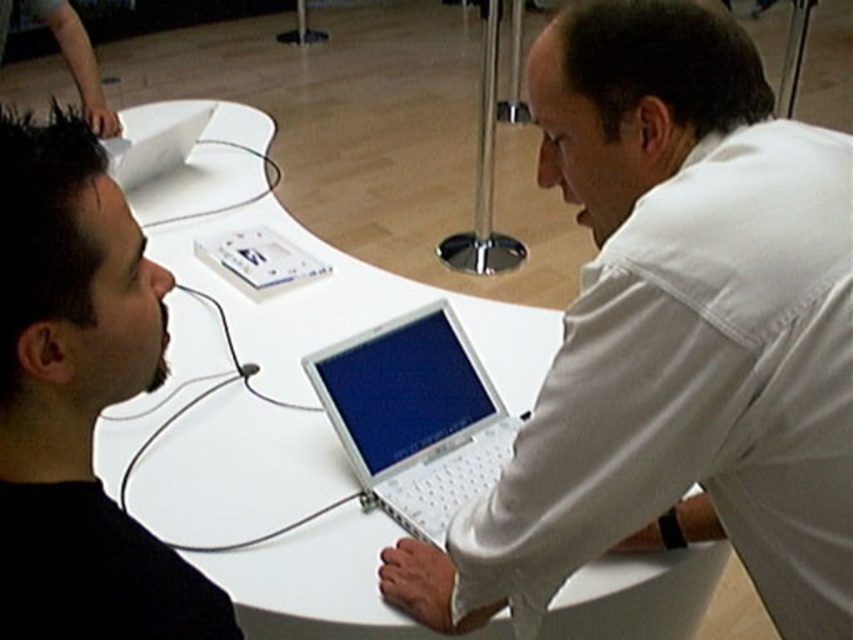
Does black matte laptop at left appear on the right side of silver metallic laptop at center?

In fact, black matte laptop at left is to the left of silver metallic laptop at center.

Who is positioned more to the left, black matte laptop at left or silver metallic laptop at center?

black matte laptop at left

Is point (62, 236) less distant than point (445, 538)?

Yes, point (62, 236) is in front of point (445, 538).

Where is `black matte laptop at left`? This screenshot has height=640, width=853. black matte laptop at left is located at coordinates (78, 401).

Identify the location of white matte laptop at center. (674, 333).

Which is behind, point (419, 618) or point (172, 497)?

Positioned behind is point (172, 497).

This screenshot has width=853, height=640. I want to click on white matte laptop at center, so click(x=674, y=333).

Which of these two, white glossy table at center or silver metallic laptop at center, stands taller?

white glossy table at center is taller.

Is white glossy table at center to the left of silver metallic laptop at center from the viewer's perspective?

Indeed, white glossy table at center is positioned on the left side of silver metallic laptop at center.

Identify the location of white glossy table at center. The width and height of the screenshot is (853, 640). (267, 353).

The image size is (853, 640). Identify the location of white glossy table at center. (267, 353).